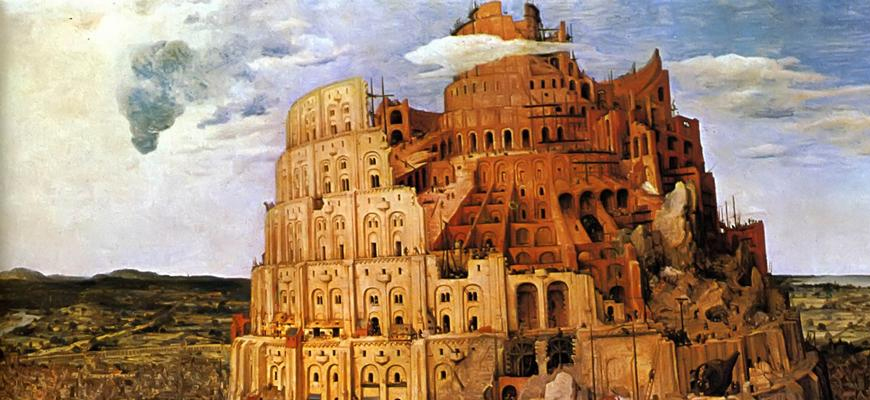
Where is `window`? This screenshot has height=400, width=870. window is located at coordinates (445, 298).